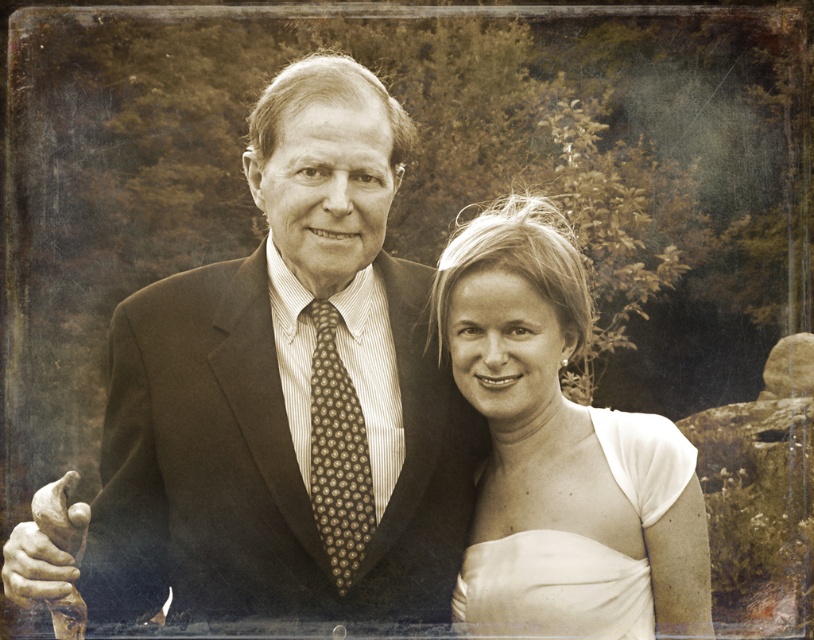
Question: Is the position of smooth white dress at center less distant than that of brown dotted tie at center?

Choices:
 (A) yes
 (B) no

Answer: (B)

Question: Which point is farther to the camera?

Choices:
 (A) dark brown textured suit at center
 (B) smooth white dress at center

Answer: (B)

Question: Based on their relative distances, which object is farther from the dark brown textured suit at center?

Choices:
 (A) smooth white dress at center
 (B) brown dotted tie at center
 (C) white satin dress at lower right

Answer: (C)

Question: Is dark brown textured suit at center further to the viewer compared to smooth white dress at center?

Choices:
 (A) yes
 (B) no

Answer: (B)

Question: Which point is closer to the camera?

Choices:
 (A) brown dotted tie at center
 (B) white satin dress at lower right
 (C) smooth white dress at center
 (D) dark brown textured suit at center

Answer: (D)

Question: Does dark brown textured suit at center appear over brown dotted tie at center?

Choices:
 (A) yes
 (B) no

Answer: (B)